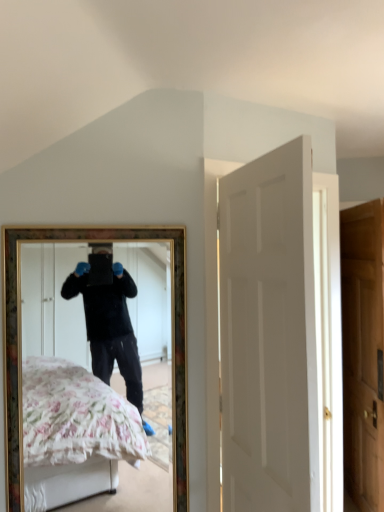
Describe the element at coordinates (91, 392) in the screenshot. I see `gold-framed mirror at center` at that location.

You are a GUI agent. You are given a task and a screenshot of the screen. Output one action in this format:
    pyautogui.click(x=<x>, y=<y>)
    Task: Click on the white matte door at center, which ranks as the 2th door in right-to-left order
    The image size is (384, 512).
    Given the screenshot: What is the action you would take?
    pyautogui.click(x=268, y=333)

Which of these two, wooden door at right, placed as the 2th door when sorted from front to back, or white matte door at center, which is the first door in left-to-right order, is thinner?

wooden door at right, placed as the 2th door when sorted from front to back.

From a real-world perspective, which object rests below the other?

wooden door at right, the first door from the back.

Is the depth of wooden door at right, placed as the 2th door when sorted from front to back, less than that of white matte door at center, the first door in the front-to-back sequence?

No, wooden door at right, placed as the 2th door when sorted from front to back, is behind white matte door at center, the first door in the front-to-back sequence.

Can you confirm if wooden door at right, placed as the 2th door when sorted from front to back, is positioned to the left of white matte door at center, which ranks as the 2th door in right-to-left order?

In fact, wooden door at right, placed as the 2th door when sorted from front to back, is to the right of white matte door at center, which ranks as the 2th door in right-to-left order.

Considering the relative positions of gold-framed mirror at center and white matte door at center, which ranks as the 2th door in right-to-left order, in the image provided, is gold-framed mirror at center to the left or to the right of white matte door at center, which ranks as the 2th door in right-to-left order,?

In the image, gold-framed mirror at center appears on the left side of white matte door at center, which ranks as the 2th door in right-to-left order.

From a real-world perspective, is gold-framed mirror at center over white matte door at center, which is the first door in left-to-right order?

No, from a real-world perspective, gold-framed mirror at center is not on top of white matte door at center, which is the first door in left-to-right order.

Are gold-framed mirror at center and white matte door at center, which is the first door in left-to-right order, making contact?

No, gold-framed mirror at center is not with white matte door at center, which is the first door in left-to-right order.

Could you tell me if gold-framed mirror at center is facing white matte door at center, the first door in the front-to-back sequence?

No, gold-framed mirror at center is not turned towards white matte door at center, the first door in the front-to-back sequence.

Do you think white matte door at center, which ranks as the 2th door in right-to-left order, is within wooden door at right, placed as the 2th door when sorted from front to back, or outside of it?

white matte door at center, which ranks as the 2th door in right-to-left order, is spatially situated outside wooden door at right, placed as the 2th door when sorted from front to back.

Considering the sizes of objects white matte door at center, which appears as the second door when viewed from the back, and wooden door at right, which is counted as the first door, starting from the right, in the image provided, who is wider, white matte door at center, which appears as the second door when viewed from the back, or wooden door at right, which is counted as the first door, starting from the right,?

With larger width is white matte door at center, which appears as the second door when viewed from the back.

In the scene shown: Could you measure the distance between white matte door at center, which appears as the second door when viewed from the back, and wooden door at right, marked as the second door in a left-to-right arrangement?

white matte door at center, which appears as the second door when viewed from the back, is 4.45 feet away from wooden door at right, marked as the second door in a left-to-right arrangement.

Is white matte door at center, which ranks as the 2th door in right-to-left order, turned away from wooden door at right, the first door from the back?

No, white matte door at center, which ranks as the 2th door in right-to-left order,'s orientation is not away from wooden door at right, the first door from the back.

Considering the positions of point (65, 245) and point (378, 320), is point (65, 245) closer or farther from the camera than point (378, 320)?

Clearly, point (65, 245) is closer to the camera than point (378, 320).

From a real-world perspective, which is physically below, gold-framed mirror at center or wooden door at right, placed as the 2th door when sorted from front to back?

From a 3D spatial view, wooden door at right, placed as the 2th door when sorted from front to back, is below.

This screenshot has height=512, width=384. I want to click on door behind the gold-framed mirror at center, so click(x=363, y=352).

Which object is more forward, gold-framed mirror at center or wooden door at right, which is counted as the first door, starting from the right?

Positioned in front is gold-framed mirror at center.

From a real-world perspective, is wooden door at right, marked as the second door in a left-to-right arrangement, on gold-framed mirror at center?

Actually, wooden door at right, marked as the second door in a left-to-right arrangement, is physically below gold-framed mirror at center in the real world.

The image size is (384, 512). Identify the location of door that is below the gold-framed mirror at center (from the image's perspective). (363, 352).

Which is in front, point (375, 365) or point (32, 489)?

The point (375, 365) is more forward.

Based on the photo, is wooden door at right, which is counted as the first door, starting from the right, turned away from gold-framed mirror at center?

No, wooden door at right, which is counted as the first door, starting from the right,'s orientation is not away from gold-framed mirror at center.

Does point (247, 186) lie in front of point (82, 418)?

Yes, point (247, 186) is in front of point (82, 418).

Would you say white matte door at center, the first door in the front-to-back sequence, is outside gold-framed mirror at center?

Yes, white matte door at center, the first door in the front-to-back sequence, is outside of gold-framed mirror at center.

Is white matte door at center, which ranks as the 2th door in right-to-left order, oriented away from gold-framed mirror at center?

Yes, gold-framed mirror at center is at the back of white matte door at center, which ranks as the 2th door in right-to-left order.

The image size is (384, 512). I want to click on door behind the white matte door at center, which ranks as the 2th door in right-to-left order, so click(363, 352).

What are the coordinates of `mirror that is below the white matte door at center, the first door in the front-to-back sequence (from the image's perspective)` in the screenshot? It's located at (91, 392).

Based on their spatial positions, is wooden door at right, the first door from the back, or white matte door at center, the first door in the front-to-back sequence, further from gold-framed mirror at center?

Among the two, white matte door at center, the first door in the front-to-back sequence, is located further to gold-framed mirror at center.

Considering their positions, is wooden door at right, placed as the 2th door when sorted from front to back, positioned further to white matte door at center, which appears as the second door when viewed from the back, than gold-framed mirror at center?

gold-framed mirror at center is positioned further to the anchor white matte door at center, which appears as the second door when viewed from the back.

From the picture: Considering their positions, is white matte door at center, which ranks as the 2th door in right-to-left order, positioned further to wooden door at right, which is counted as the first door, starting from the right, than gold-framed mirror at center?

gold-framed mirror at center is positioned further to the anchor wooden door at right, which is counted as the first door, starting from the right.

Which object lies further to the anchor point wooden door at right, the first door from the back, gold-framed mirror at center or white matte door at center, which appears as the second door when viewed from the back?

gold-framed mirror at center is positioned further to the anchor wooden door at right, the first door from the back.

Based on their spatial positions, is white matte door at center, the first door in the front-to-back sequence, or wooden door at right, placed as the 2th door when sorted from front to back, further from gold-framed mirror at center?

The object further to gold-framed mirror at center is white matte door at center, the first door in the front-to-back sequence.

Estimate the real-world distances between objects in this image. Which object is closer to white matte door at center, which ranks as the 2th door in right-to-left order, gold-framed mirror at center or wooden door at right, which is counted as the first door, starting from the right?

The object closer to white matte door at center, which ranks as the 2th door in right-to-left order, is wooden door at right, which is counted as the first door, starting from the right.

Identify the location of door situated between gold-framed mirror at center and wooden door at right, marked as the second door in a left-to-right arrangement, from left to right. (268, 333).